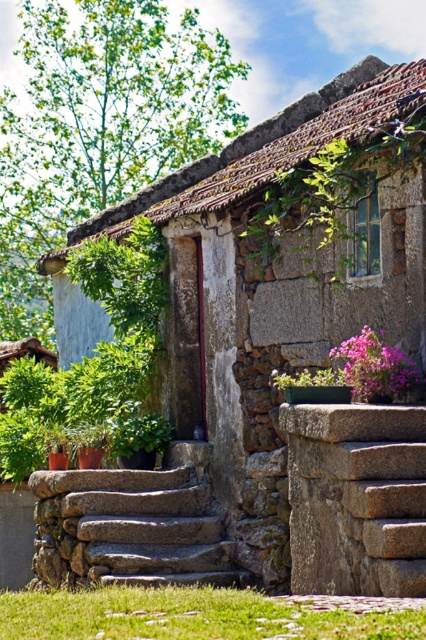
Question: Does gray rough stone steps at center appear over purple matte flower pot at center?

Choices:
 (A) yes
 (B) no

Answer: (B)

Question: Is granite steps at center closer to the viewer compared to pink matte flower at center-right?

Choices:
 (A) yes
 (B) no

Answer: (B)

Question: Which of these objects is positioned farthest from the purple matte flower pot at center?

Choices:
 (A) pink matte flower at center-right
 (B) green grass at lower left
 (C) gray rough stone steps at center

Answer: (B)

Question: Considering the real-world distances, which object is closest to the purple matte flower pot at center?

Choices:
 (A) green grass at lower left
 (B) granite steps at center
 (C) gray rough stone steps at center
 (D) pink matte flower at center-right

Answer: (D)

Question: Which object is positioned farthest from the pink matte flower at center-right?

Choices:
 (A) green grass at lower left
 (B) granite steps at center
 (C) gray rough stone steps at center

Answer: (B)

Question: Is gray rough stone steps at center positioned behind purple matte flower pot at center?

Choices:
 (A) yes
 (B) no

Answer: (B)